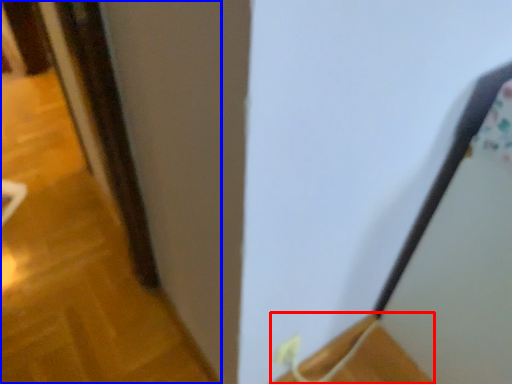
Question: Which point is further to the camera, wood (highlighted by a red box) or door (highlighted by a blue box)?

Choices:
 (A) wood
 (B) door

Answer: (B)